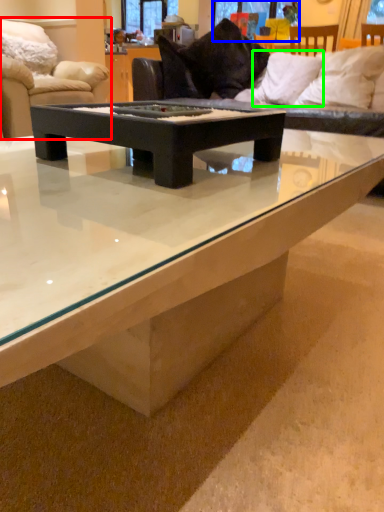
Question: Which object is positioned farthest from studio couch (highlighted by a red box)? Select from window screen (highlighted by a blue box) and pillow (highlighted by a green box).

Choices:
 (A) window screen
 (B) pillow

Answer: (A)